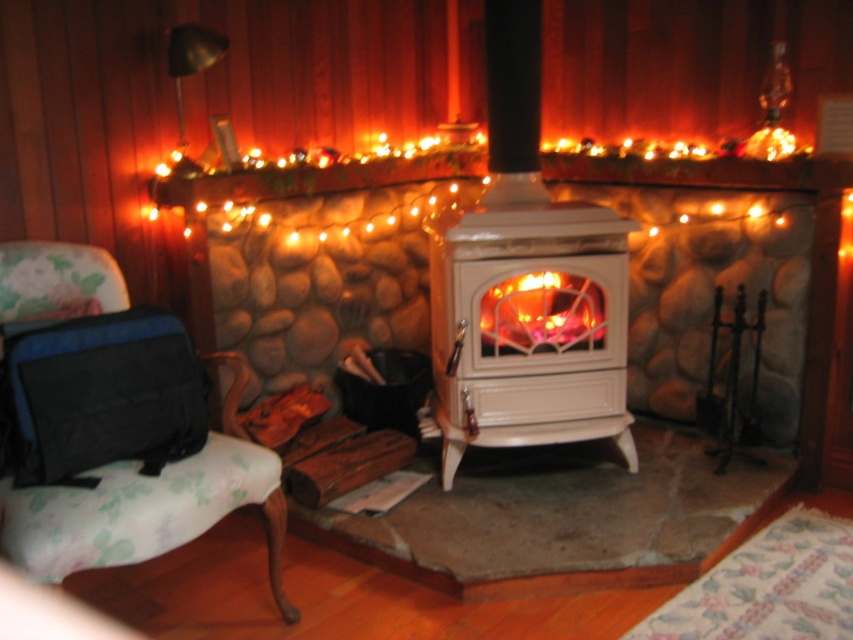
Question: Is floral fabric armchair at left below orange glowing wood at center?

Choices:
 (A) yes
 (B) no

Answer: (A)

Question: Can you confirm if white glossy wood-burning stove at center is thinner than floral fabric armchair at left?

Choices:
 (A) no
 (B) yes

Answer: (A)

Question: Can you confirm if white glossy wood-burning stove at center is positioned to the right of orange glowing wood at center?

Choices:
 (A) no
 (B) yes

Answer: (A)

Question: Which point is closer to the camera?

Choices:
 (A) white glossy wood-burning stove at center
 (B) orange glowing wood at center

Answer: (A)

Question: Which of the following is the farthest from the observer?

Choices:
 (A) (74, 266)
 (B) (483, 296)
 (C) (567, 243)

Answer: (C)

Question: Among these points, which one is farthest from the camera?

Choices:
 (A) (590, 230)
 (B) (485, 300)

Answer: (B)